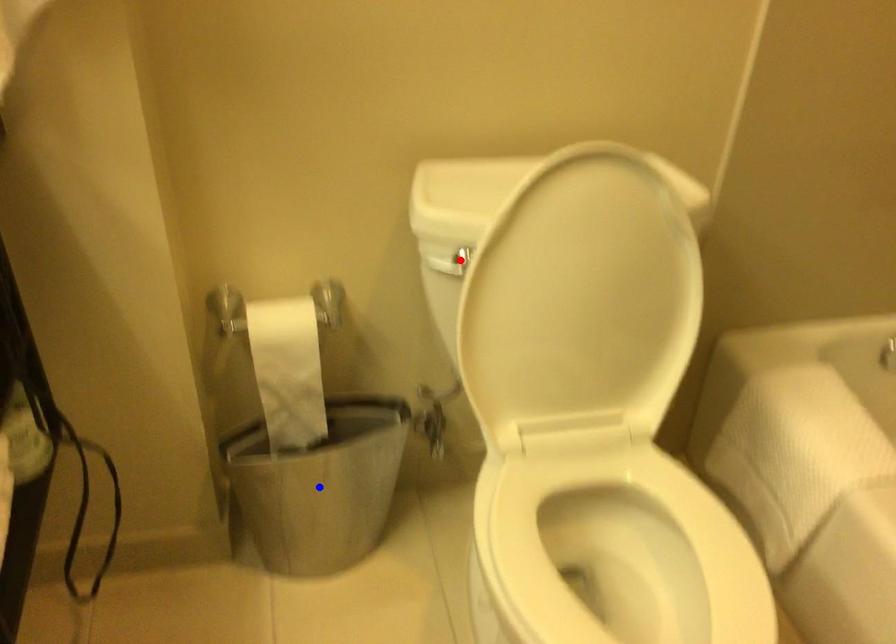
Question: Two points are marked on the image. Which point is closer to the camera?

Choices:
 (A) Blue point is closer.
 (B) Red point is closer.

Answer: (B)